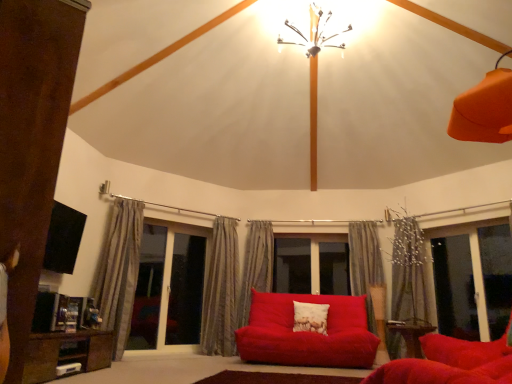
Where is `transparent glass screen door at lower left, the first screen door viewed from the right`? The image size is (512, 384). transparent glass screen door at lower left, the first screen door viewed from the right is located at coordinates (186, 290).

What do you see at coordinates (220, 290) in the screenshot? The width and height of the screenshot is (512, 384). I see `silky beige curtain at center, which is the 2th curtain in left-to-right order` at bounding box center [220, 290].

The height and width of the screenshot is (384, 512). I want to click on silky gray curtain at center, which ranks as the fourth curtain in left-to-right order, so click(369, 278).

Which is behind, transparent glass screen door at left, the first screen door viewed from the left, or silky gray curtain at center, marked as the third curtain in a left-to-right arrangement?

silky gray curtain at center, marked as the third curtain in a left-to-right arrangement, is more distant.

Is transparent glass screen door at left, the first screen door viewed from the left, smaller than silky gray curtain at center, placed as the 3th curtain when sorted from right to left?

Incorrect, transparent glass screen door at left, the first screen door viewed from the left, is not smaller in size than silky gray curtain at center, placed as the 3th curtain when sorted from right to left.

Which is in front, point (197, 262) or point (272, 259)?

The point (197, 262) is closer.

From a real-world perspective, who is located lower, transparent glass screen door at lower left, acting as the second screen door starting from the left, or wooden table at lower right, which appears as the 2th table when viewed from the left?

wooden table at lower right, which appears as the 2th table when viewed from the left.

Based on the photo, is transparent glass screen door at lower left, acting as the second screen door starting from the left, smaller than wooden table at lower right, the 1th table positioned from the back?

No.

Is point (172, 262) closer to camera compared to point (407, 322)?

No, it is behind (407, 322).

From the image's perspective, between velvet red studio couch at center and transparent glass screen door at lower left, the first screen door viewed from the right, who is located below?

From the image's view, velvet red studio couch at center is below.

Is there a large distance between velvet red studio couch at center and transparent glass screen door at lower left, acting as the second screen door starting from the left?

Yes.

Is transparent glass screen door at lower left, acting as the second screen door starting from the left, inside velvet red studio couch at center?

Actually, transparent glass screen door at lower left, acting as the second screen door starting from the left, is outside velvet red studio couch at center.

From the picture: Which is more distant, (x=262, y=324) or (x=194, y=343)?

The point (x=194, y=343) is behind.

Is silky beige curtain at center, which is the 2th curtain in left-to-right order, a part of brown wooden table at lower left, the 1th table from the left?

No, silky beige curtain at center, which is the 2th curtain in left-to-right order, is not surrounded by brown wooden table at lower left, the 1th table from the left.

Which of these two, brown wooden table at lower left, acting as the 2th table starting from the back, or silky beige curtain at center, which appears as the 4th curtain when viewed from the right, is smaller?

Answer: brown wooden table at lower left, acting as the 2th table starting from the back, is smaller.

Looking at this image, is brown wooden table at lower left, marked as the 2th table in a right-to-left arrangement, far from silky beige curtain at center, which is the 2th curtain in left-to-right order?

That's right, there is a large distance between brown wooden table at lower left, marked as the 2th table in a right-to-left arrangement, and silky beige curtain at center, which is the 2th curtain in left-to-right order.

Considering the points (64, 344) and (223, 333), which point is in front, point (64, 344) or point (223, 333)?

The point (64, 344) is closer.

Based on the photo, from the image's perspective, who appears lower, transparent glass screen door at left, the first screen door viewed from the left, or velvet red studio couch at center?

velvet red studio couch at center, from the image's perspective.

From a real-world perspective, which is physically above, transparent glass screen door at left, the second screen door when ordered from right to left, or velvet red studio couch at center?

transparent glass screen door at left, the second screen door when ordered from right to left, from a real-world perspective.

Is transparent glass screen door at left, the first screen door viewed from the left, at the right side of velvet red studio couch at center?

No.

Is transparent glass screen door at left, the first screen door viewed from the left, taller or shorter than velvet red studio couch at center?

Considering their sizes, transparent glass screen door at left, the first screen door viewed from the left, has more height than velvet red studio couch at center.

Do you think white textured pillow at center is within silky gray curtain at right, the first curtain viewed from the right, or outside of it?

white textured pillow at center is outside silky gray curtain at right, the first curtain viewed from the right.

Are white textured pillow at center and silky gray curtain at right, the first curtain viewed from the right, far apart?

Yes.

From a real-world perspective, is white textured pillow at center on top of silky gray curtain at right, the fifth curtain from the left?

No, from a real-world perspective, white textured pillow at center is not above silky gray curtain at right, the fifth curtain from the left.

Is white textured pillow at center oriented away from silky gray curtain at right, the first curtain viewed from the right?

No, white textured pillow at center is not facing away from silky gray curtain at right, the first curtain viewed from the right.

Does point (344, 312) lie behind point (328, 306)?

Yes.

From a real-world perspective, is velvet red studio couch at center on top of white textured pillow at center?

No, from a real-world perspective, velvet red studio couch at center is not over white textured pillow at center

Is velvet red studio couch at center positioned beyond the bounds of white textured pillow at center?

Yes.

The image size is (512, 384). In order to click on pillow above the velvet red studio couch at center (from a real-world perspective) in this screenshot , I will do coord(310,317).

There is a transparent glass screen door at left, the first screen door viewed from the left. Where is `the 2nd curtain above it (from a real-world perspective)`? The height and width of the screenshot is (384, 512). the 2nd curtain above it (from a real-world perspective) is located at coordinates (256, 266).

In order to click on the 1st screen door counting from the left side of the wooden table at lower right, which appears as the second table when viewed from the front in this screenshot , I will do `click(186, 290)`.

Estimate the real-world distances between objects in this image. Which object is closer to transparent glass screen door at lower left, acting as the second screen door starting from the left, velvet red studio couch at center or silky gray curtain at right, the first curtain viewed from the right?

Among the two, velvet red studio couch at center is located nearer to transparent glass screen door at lower left, acting as the second screen door starting from the left.

When comparing their distances from wooden table at lower right, which appears as the 2th table when viewed from the left, does silky beige curtain at center, which appears as the 4th curtain when viewed from the right, or gray textured curtain at left, which is the 1th curtain in left-to-right order, seem further?

gray textured curtain at left, which is the 1th curtain in left-to-right order, is positioned further to the anchor wooden table at lower right, which appears as the 2th table when viewed from the left.

Which object lies nearer to the anchor point white textured pillow at center, brown wooden table at lower left, which is the 1th table from front to back, or metallic chandelier at upper center?

brown wooden table at lower left, which is the 1th table from front to back, is closer to white textured pillow at center.

Looking at this image, when comparing their distances from silky gray curtain at center, which ranks as the fourth curtain in left-to-right order, does transparent glass window at center or silky gray curtain at right, the first curtain viewed from the right, seem closer?

Based on the image, silky gray curtain at right, the first curtain viewed from the right, appears to be nearer to silky gray curtain at center, which ranks as the fourth curtain in left-to-right order.

From the image, which object appears to be nearer to transparent glass screen door at left, the second screen door when ordered from right to left, metallic chandelier at upper center or silky gray curtain at center, which is counted as the 2th curtain, starting from the right?

silky gray curtain at center, which is counted as the 2th curtain, starting from the right, is closer to transparent glass screen door at left, the second screen door when ordered from right to left.

Looking at the image, which one is located closer to transparent glass screen door at lower left, the first screen door viewed from the right, metallic chandelier at upper center or brown wooden table at lower left, acting as the 2th table starting from the back?

The object closer to transparent glass screen door at lower left, the first screen door viewed from the right, is brown wooden table at lower left, acting as the 2th table starting from the back.

Consider the image. Based on their spatial positions, is transparent glass window at center or transparent glass screen door at lower left, the first screen door viewed from the right, closer to silky gray curtain at center, which ranks as the fourth curtain in left-to-right order?

The object closer to silky gray curtain at center, which ranks as the fourth curtain in left-to-right order, is transparent glass window at center.

Looking at the image, which one is located further to brown wooden table at lower left, marked as the 2th table in a right-to-left arrangement, gray textured curtain at left, the 5th curtain from the right, or metallic chandelier at upper center?

The object further to brown wooden table at lower left, marked as the 2th table in a right-to-left arrangement, is metallic chandelier at upper center.

The image size is (512, 384). In order to click on pillow located between brown wooden table at lower left, which is the 1th table from front to back, and silky beige curtain at center, which appears as the 4th curtain when viewed from the right, in the depth direction in this screenshot , I will do `click(310, 317)`.

Identify the location of curtain between gray textured curtain at left, which is the 1th curtain in left-to-right order, and silky gray curtain at center, placed as the 3th curtain when sorted from right to left, from left to right. (220, 290).

Find the location of a particular element. Image resolution: width=512 pixels, height=384 pixels. pillow between transparent glass screen door at lower left, the first screen door viewed from the right, and wooden table at lower right, which appears as the 2th table when viewed from the left, in the horizontal direction is located at coordinates (310, 317).

I want to click on studio couch between brown wooden table at lower left, the 1th table from the left, and silky gray curtain at center, placed as the 3th curtain when sorted from right to left, along the z-axis, so 307,333.